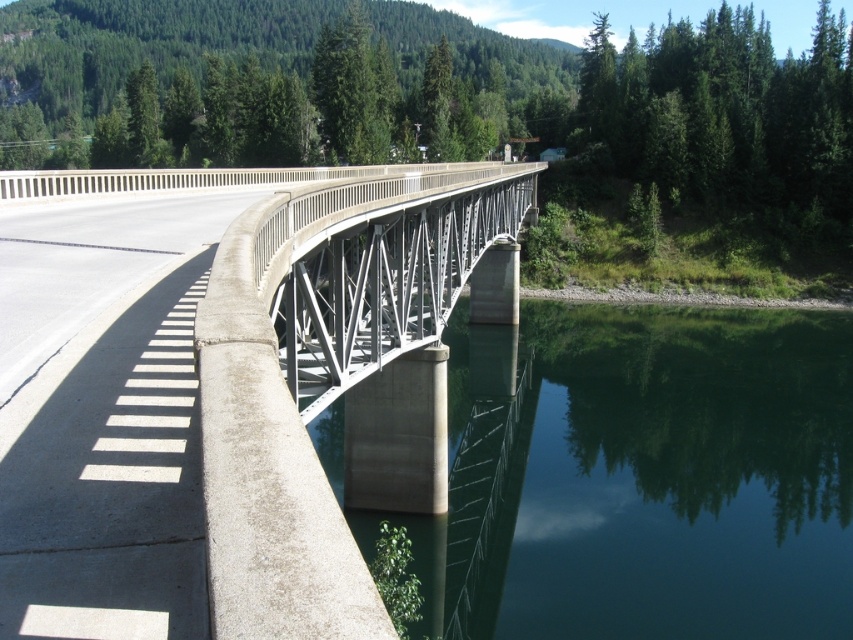
Can you confirm if green smooth water at lower center is thinner than metallic gray bridge at center?

In fact, green smooth water at lower center might be wider than metallic gray bridge at center.

Between green smooth water at lower center and metallic gray bridge at center, which one is positioned higher?

metallic gray bridge at center

Does point (782, 596) lie behind point (397, 333)?

Yes, point (782, 596) is behind point (397, 333).

What are the coordinates of `green smooth water at lower center` in the screenshot? It's located at (646, 480).